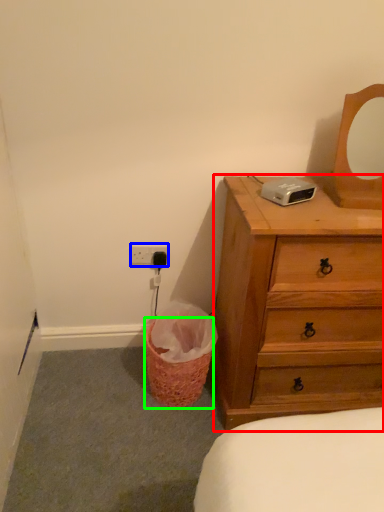
Question: Which object is the farthest from chest of drawers (highlighted by a red box)? Choose among these: electric outlet (highlighted by a blue box) or basket (highlighted by a green box).

Choices:
 (A) electric outlet
 (B) basket

Answer: (A)